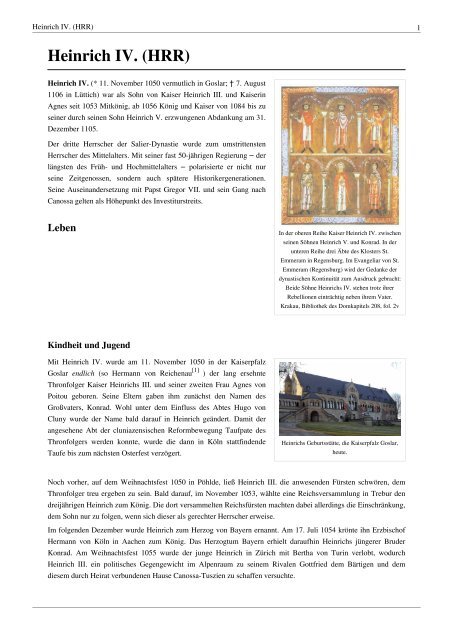
At what (x,y) coordinates should I click in order to perform the action: click on stairs. Please return your answer as a coordinate pair (x, y). Image resolution: width=453 pixels, height=640 pixels. Looking at the image, I should click on (300, 420).